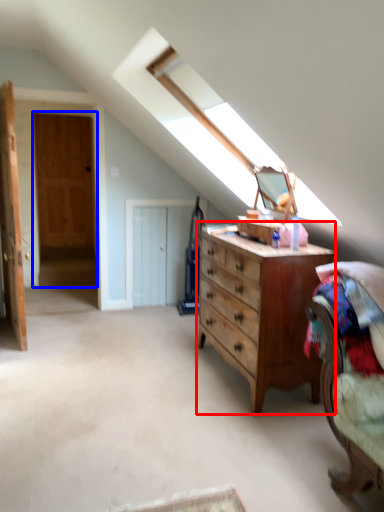
Question: Among these objects, which one is nearest to the camera, chest of drawers (highlighted by a red box) or door (highlighted by a blue box)?

Choices:
 (A) chest of drawers
 (B) door

Answer: (A)